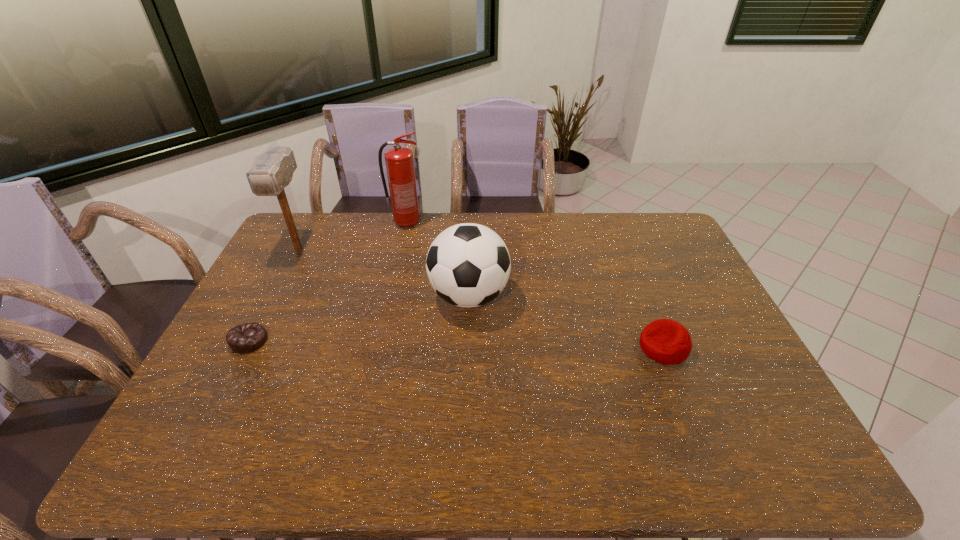
Locate an element on the screen. The width and height of the screenshot is (960, 540). free space between the fourth nearest object and the fire extinguisher is located at coordinates (352, 237).

Where is `free space between the second object from right to left and the mallet`? The width and height of the screenshot is (960, 540). free space between the second object from right to left and the mallet is located at coordinates (384, 273).

I want to click on empty location between the second farthest object and the third farthest object, so pos(384,273).

Locate an element on the screen. The image size is (960, 540). empty location between the third object from left to right and the shortest object is located at coordinates (328, 282).

Locate an element on the screen. Image resolution: width=960 pixels, height=540 pixels. free space between the third farthest object and the mallet is located at coordinates (384, 273).

You are a GUI agent. You are given a task and a screenshot of the screen. Output one action in this format:
    pyautogui.click(x=<x>, y=<y>)
    Task: Click on the unoccupied position between the third object from right to left and the shorter beanbag
    
    Given the screenshot: What is the action you would take?
    pyautogui.click(x=328, y=282)

I want to click on object that can be found as the third closest to the second object from right to left, so click(x=271, y=171).

Identify which object is the third nearest to the rightmost object. Please provide its 2D coordinates. Your answer should be formatted as a tuple, i.e. [(x, y)], where the tuple contains the x and y coordinates of a point satisfying the conditions above.

[(246, 338)]

At what (x,y) coordinates should I click in order to perform the action: click on vacant area that satisfies the following two spatial constraints: 1. on the striking face of the soccer ball; 2. on the right side of the mallet. Please return your answer as a coordinate pair (x, y). This screenshot has width=960, height=540. Looking at the image, I should click on (276, 296).

You are a GUI agent. You are given a task and a screenshot of the screen. Output one action in this format:
    pyautogui.click(x=<x>, y=<y>)
    Task: Click on the free space in the image that satisfies the following two spatial constraints: 1. on the handle side the third object from right to left; 2. on the left side of the soccer ball
    
    Given the screenshot: What is the action you would take?
    pyautogui.click(x=390, y=296)